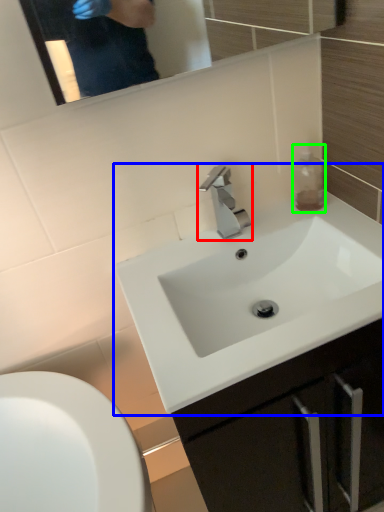
Question: Considering the real-world distances, which object is closest to tap (highlighted by a red box)? sink (highlighted by a blue box) or bottle (highlighted by a green box).

Choices:
 (A) sink
 (B) bottle

Answer: (B)